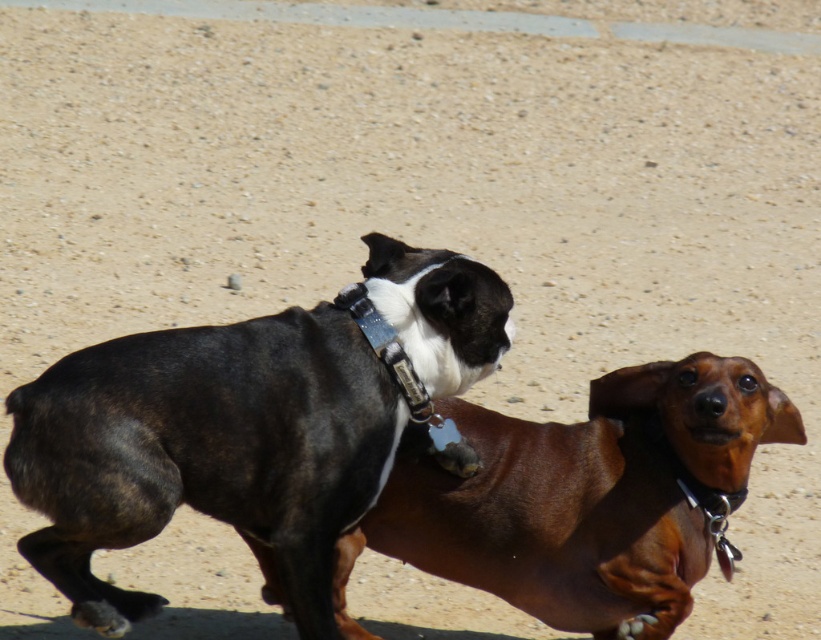
Question: Can you confirm if black leather dog at center is positioned to the left of brown shiny dachshund at center?

Choices:
 (A) yes
 (B) no

Answer: (A)

Question: Which of the following is the closest to the observer?

Choices:
 (A) black leather dog at center
 (B) brown shiny dachshund at center

Answer: (A)

Question: Is black leather dog at center to the right of brown shiny dachshund at center from the viewer's perspective?

Choices:
 (A) yes
 (B) no

Answer: (B)

Question: Which of the following is the closest to the observer?

Choices:
 (A) (391, 385)
 (B) (455, 572)

Answer: (A)

Question: Is black leather dog at center thinner than brown shiny dachshund at center?

Choices:
 (A) no
 (B) yes

Answer: (B)